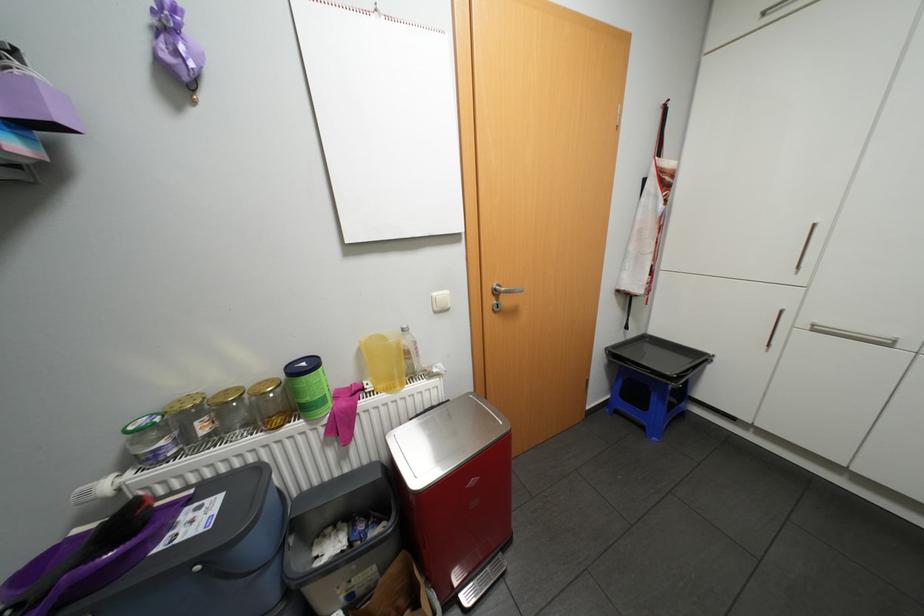
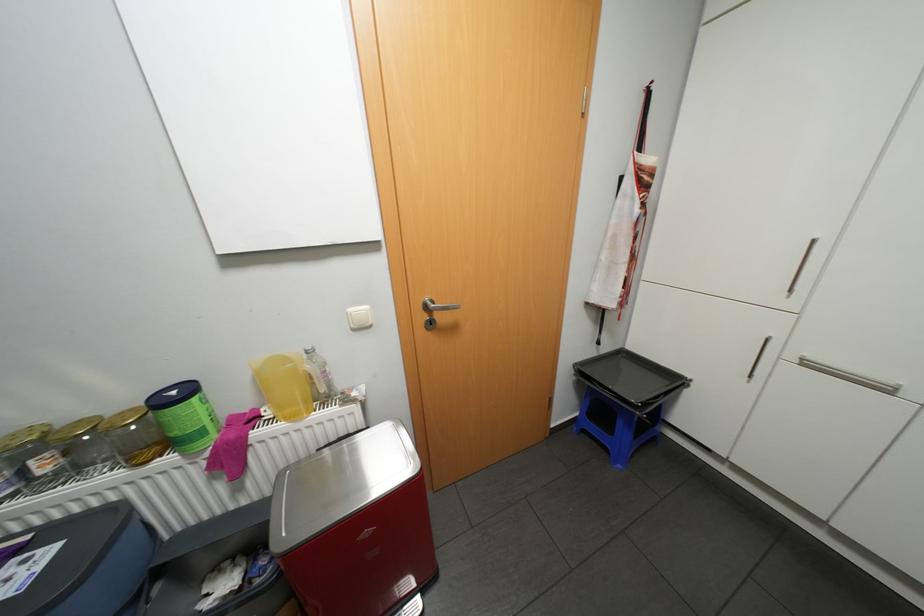
Locate, in the second image, the point that corresponds to point 707,357 in the first image.

(684, 379)